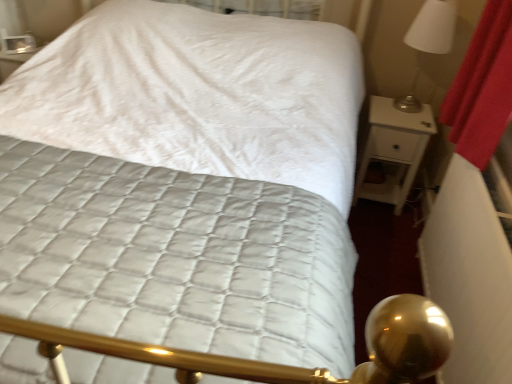
What do you see at coordinates (394, 150) in the screenshot? The height and width of the screenshot is (384, 512). I see `white glossy nightstand at right` at bounding box center [394, 150].

Image resolution: width=512 pixels, height=384 pixels. I want to click on white glossy nightstand at right, so pos(394,150).

At what (x,y) coordinates should I click in order to perform the action: click on white glossy lampshade at upper right. Please return your answer as a coordinate pair (x, y). This screenshot has width=512, height=384. Looking at the image, I should click on (428, 42).

The height and width of the screenshot is (384, 512). Describe the element at coordinates (428, 42) in the screenshot. I see `white glossy lampshade at upper right` at that location.

Measure the distance between point [419,111] and camera.

The depth of point [419,111] is 7.29 feet.

Where is `white glossy nightstand at right`? This screenshot has width=512, height=384. white glossy nightstand at right is located at coordinates (394, 150).

Visually, is white glossy nightstand at right positioned to the left or to the right of white glossy lampshade at upper right?

Based on their positions, white glossy nightstand at right is located to the left of white glossy lampshade at upper right.

Considering the positions of objects white glossy nightstand at right and white glossy lampshade at upper right in the image provided, who is in front, white glossy nightstand at right or white glossy lampshade at upper right?

white glossy lampshade at upper right is in front.

Is point (358, 197) positioned after point (429, 26)?

Yes, point (358, 197) is farther from viewer.

From the image's perspective, is white glossy nightstand at right positioned above or below white glossy lampshade at upper right?

white glossy nightstand at right is below white glossy lampshade at upper right.

From a real-world perspective, is white glossy nightstand at right on white glossy lampshade at upper right?

Incorrect, from a real-world perspective, white glossy nightstand at right is lower than white glossy lampshade at upper right.

Between white glossy nightstand at right and white glossy lampshade at upper right, which one has larger width?

white glossy nightstand at right.

Which of these two, white glossy nightstand at right or white glossy lampshade at upper right, stands shorter?

white glossy lampshade at upper right is shorter.

Can you confirm if white glossy nightstand at right is bigger than white glossy lampshade at upper right?

Indeed, white glossy nightstand at right has a larger size compared to white glossy lampshade at upper right.

Is white glossy nightstand at right outside of white glossy lampshade at upper right?

white glossy nightstand at right is positioned outside white glossy lampshade at upper right.

Would you consider white glossy nightstand at right to be distant from white glossy lampshade at upper right?

That's not correct — white glossy nightstand at right is a little close to white glossy lampshade at upper right.

Is white glossy nightstand at right facing towards white glossy lampshade at upper right?

No, white glossy nightstand at right does not turn towards white glossy lampshade at upper right.

How different are the orientations of white glossy nightstand at right and white glossy lampshade at upper right in degrees?

white glossy nightstand at right and white glossy lampshade at upper right are facing 0.231 degrees away from each other.

What are the coordinates of `bedside lamp on the right of white glossy nightstand at right` in the screenshot? It's located at (428, 42).

Consider the image. Can you confirm if white glossy lampshade at upper right is positioned to the right of white glossy nightstand at right?

Yes.

Between white glossy lampshade at upper right and white glossy nightstand at right, which one is positioned in front?

Positioned in front is white glossy lampshade at upper right.

Is point (423, 35) positioned in front of point (380, 196)?

That is True.

Based on the photo, from the image's perspective, does white glossy lampshade at upper right appear higher than white glossy nightstand at right?

Indeed, from the image's perspective, white glossy lampshade at upper right is shown above white glossy nightstand at right.

From a real-world perspective, who is located lower, white glossy lampshade at upper right or white glossy nightstand at right?

From a 3D spatial view, white glossy nightstand at right is below.

Between white glossy lampshade at upper right and white glossy nightstand at right, which one has larger width?

With larger width is white glossy nightstand at right.

From their relative heights in the image, would you say white glossy lampshade at upper right is taller or shorter than white glossy nightstand at right?

Clearly, white glossy lampshade at upper right is shorter compared to white glossy nightstand at right.

Considering the sizes of objects white glossy lampshade at upper right and white glossy nightstand at right in the image provided, who is smaller, white glossy lampshade at upper right or white glossy nightstand at right?

Smaller between the two is white glossy lampshade at upper right.

Is white glossy lampshade at upper right not within white glossy nightstand at right?

white glossy lampshade at upper right is positioned outside white glossy nightstand at right.

Are white glossy lampshade at upper right and white glossy nightstand at right making contact?

No, white glossy lampshade at upper right is not in contact with white glossy nightstand at right.

Is white glossy lampshade at upper right oriented towards white glossy nightstand at right?

No, white glossy lampshade at upper right is not aimed at white glossy nightstand at right.

What's the angular difference between white glossy lampshade at upper right and white glossy nightstand at right's facing directions?

0.231 degrees separate the facing orientations of white glossy lampshade at upper right and white glossy nightstand at right.

Where is `bedside lamp that is above the white glossy nightstand at right (from the image's perspective)`? The width and height of the screenshot is (512, 384). bedside lamp that is above the white glossy nightstand at right (from the image's perspective) is located at coordinates (428, 42).

This screenshot has height=384, width=512. Identify the location of nightstand below the white glossy lampshade at upper right (from the image's perspective). tap(394, 150).

Find the location of a particular element. The width and height of the screenshot is (512, 384). nightstand to the left of white glossy lampshade at upper right is located at coordinates (394, 150).